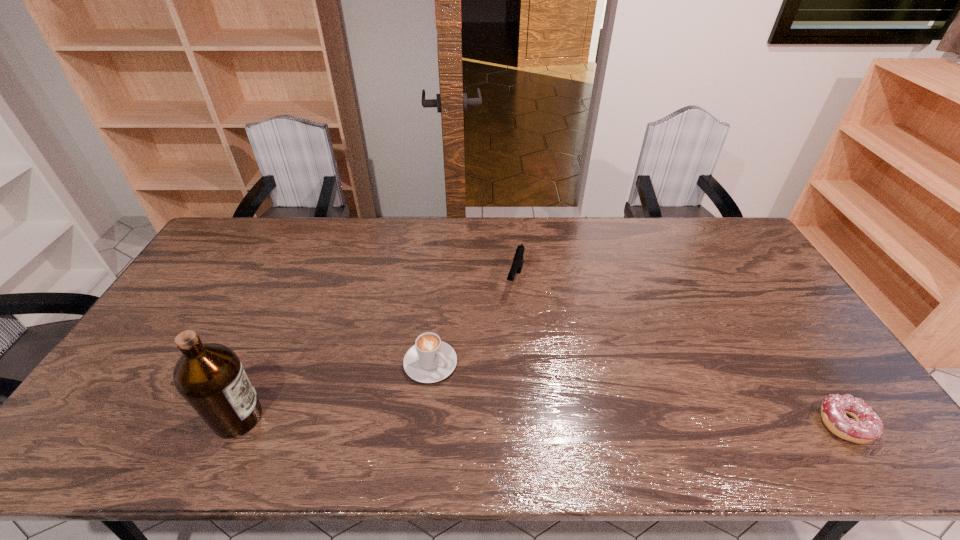
In the image, there is a desktop. Identify the location of vacant region at the far edge. The image size is (960, 540). (549, 222).

This screenshot has width=960, height=540. In order to click on free space at the near edge in this screenshot , I will do `click(543, 419)`.

At what (x,y) coordinates should I click in order to perform the action: click on vacant space at the left edge of the desktop. Please return your answer as a coordinate pair (x, y). Image resolution: width=960 pixels, height=540 pixels. Looking at the image, I should click on (142, 346).

In the image, there is a desktop. What are the coordinates of `vacant region at the right edge` in the screenshot? It's located at (739, 273).

Locate an element on the screen. free space at the far right corner is located at coordinates (717, 248).

Find the location of a particular element. vacant area that lies between the pistol and the doughnut is located at coordinates (680, 352).

Where is `free space that is in between the farthest object and the shortest object`? The image size is (960, 540). free space that is in between the farthest object and the shortest object is located at coordinates (680, 352).

Where is `empty location between the doughnut and the leftmost object`? The image size is (960, 540). empty location between the doughnut and the leftmost object is located at coordinates (541, 421).

Identify the location of vacant point located between the pistol and the second farthest object. This screenshot has height=540, width=960. (473, 321).

Find the location of a particular element. The height and width of the screenshot is (540, 960). empty space that is in between the shortest object and the cappuccino is located at coordinates (637, 394).